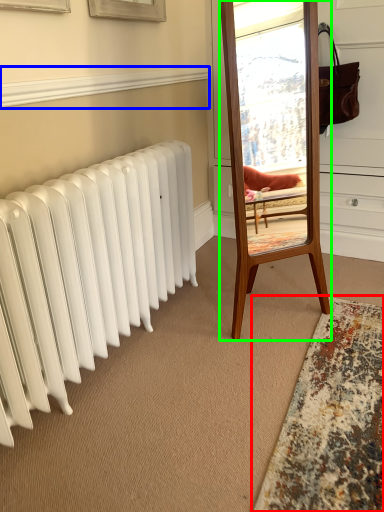
Question: Which is nearer to the mat (highlighted by a red box)? window sill (highlighted by a blue box) or mirror (highlighted by a green box).

Choices:
 (A) window sill
 (B) mirror

Answer: (B)